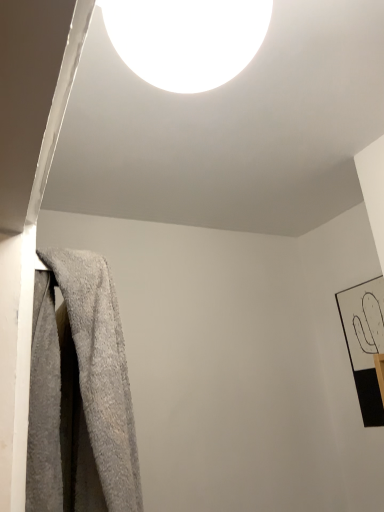
Question: Would you consider white glossy light fixture at upper center to be distant from gray fluffy towel at left?

Choices:
 (A) yes
 (B) no

Answer: (B)

Question: Does white glossy light fixture at upper center have a lesser width compared to gray fluffy towel at left?

Choices:
 (A) no
 (B) yes

Answer: (B)

Question: From a real-world perspective, is white glossy light fixture at upper center located higher than gray fluffy towel at left?

Choices:
 (A) no
 (B) yes

Answer: (B)

Question: Considering the relative positions of white glossy light fixture at upper center and gray fluffy towel at left in the image provided, is white glossy light fixture at upper center to the right of gray fluffy towel at left from the viewer's perspective?

Choices:
 (A) yes
 (B) no

Answer: (A)

Question: Can you confirm if white glossy light fixture at upper center is taller than gray fluffy towel at left?

Choices:
 (A) yes
 (B) no

Answer: (B)

Question: Considering the positions of gray fluffy towel at left and white glossy light fixture at upper center in the image, is gray fluffy towel at left taller or shorter than white glossy light fixture at upper center?

Choices:
 (A) tall
 (B) short

Answer: (A)

Question: From the image's perspective, is gray fluffy towel at left above or below white glossy light fixture at upper center?

Choices:
 (A) below
 (B) above

Answer: (A)

Question: From a real-world perspective, is gray fluffy towel at left physically located above or below white glossy light fixture at upper center?

Choices:
 (A) above
 (B) below

Answer: (B)

Question: Considering their positions, is gray fluffy towel at left located in front of or behind white glossy light fixture at upper center?

Choices:
 (A) front
 (B) behind

Answer: (B)

Question: Considering the positions of gray fluffy towel at left and black matte picture frame at right in the image, is gray fluffy towel at left bigger or smaller than black matte picture frame at right?

Choices:
 (A) big
 (B) small

Answer: (A)

Question: Is gray fluffy towel at left wider or thinner than black matte picture frame at right?

Choices:
 (A) thin
 (B) wide

Answer: (B)

Question: Is point (61, 441) closer or farther from the camera than point (365, 324)?

Choices:
 (A) closer
 (B) farther

Answer: (A)

Question: Is gray fluffy towel at left taller or shorter than black matte picture frame at right?

Choices:
 (A) tall
 (B) short

Answer: (B)

Question: In terms of height, does white glossy light fixture at upper center look taller or shorter compared to gray fluffy towel at left?

Choices:
 (A) tall
 (B) short

Answer: (B)

Question: Choose the correct answer: Is white glossy light fixture at upper center inside gray fluffy towel at left or outside it?

Choices:
 (A) outside
 (B) inside

Answer: (A)